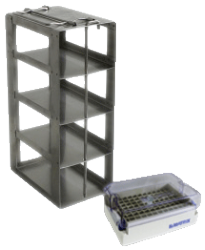
Identify the location of middle shelf. (70, 105), (72, 149).